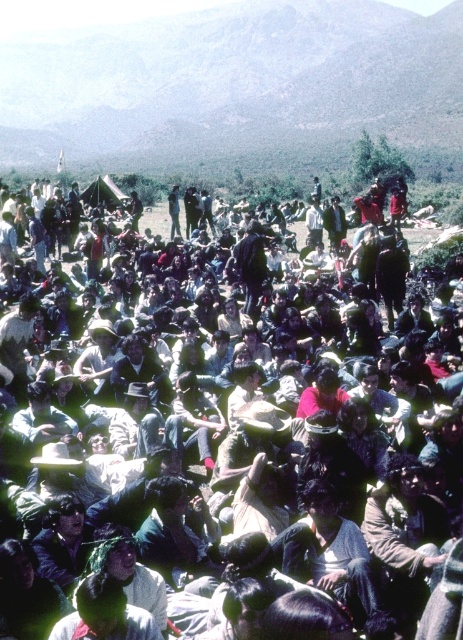
Between green grassy hillside at upper center and dark clothing crowd at center, which one appears on the right side from the viewer's perspective?

dark clothing crowd at center is more to the right.

Can you confirm if green grassy hillside at upper center is thinner than dark clothing crowd at center?

In fact, green grassy hillside at upper center might be wider than dark clothing crowd at center.

At what (x,y) coordinates should I click in order to perform the action: click on green grassy hillside at upper center. Please return your answer as a coordinate pair (x, y). The image size is (463, 640). Looking at the image, I should click on (237, 88).